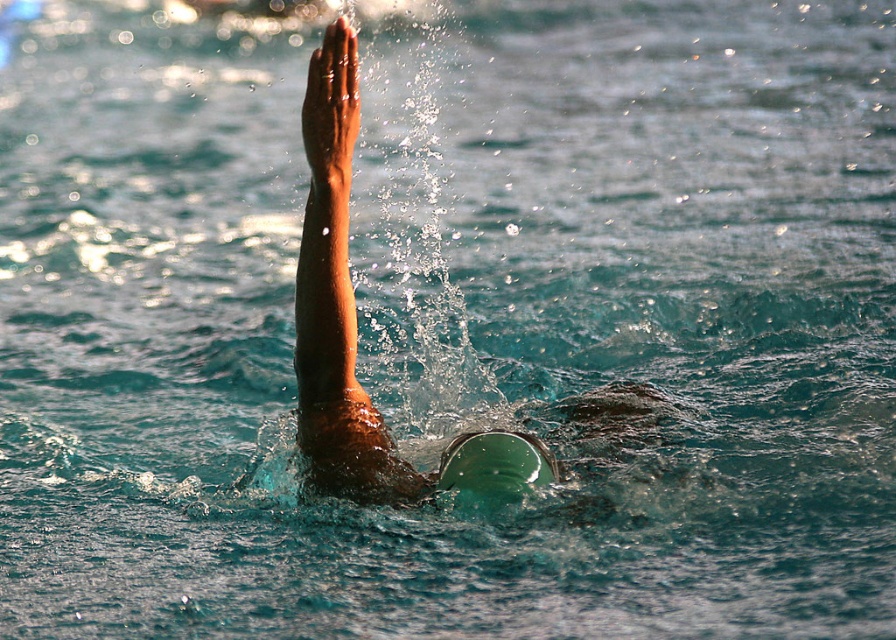
You are a lifeguard observing a swimmer in the pool. You notice the clear water splash at upper center and the green rubber swim cap at center. Which object takes up more space in the image?

The clear water splash at upper center is bigger than the green rubber swim cap at center, so it takes up more space in the image.

You are a lifeguard standing at the edge of the pool. You need to locate the swimmer quickly. Based on the coordinates provided in the image, where exactly is the matte skin at center located?

The matte skin at center is located at coordinates point (337,304).

You are a lifeguard trying to assess the safety of the swimmer. The safety protocol states that the splash must be at least 40 inches away from the swimmer to avoid choking hazards. Based on the image, is the clear water splash at upper center far enough from the matte skin at center?

The distance between the clear water splash at upper center and the matte skin at center is 38.35 inches, which is less than the required 40 inches. Therefore, the splash is too close to the swimmer, posing a potential choking hazard.